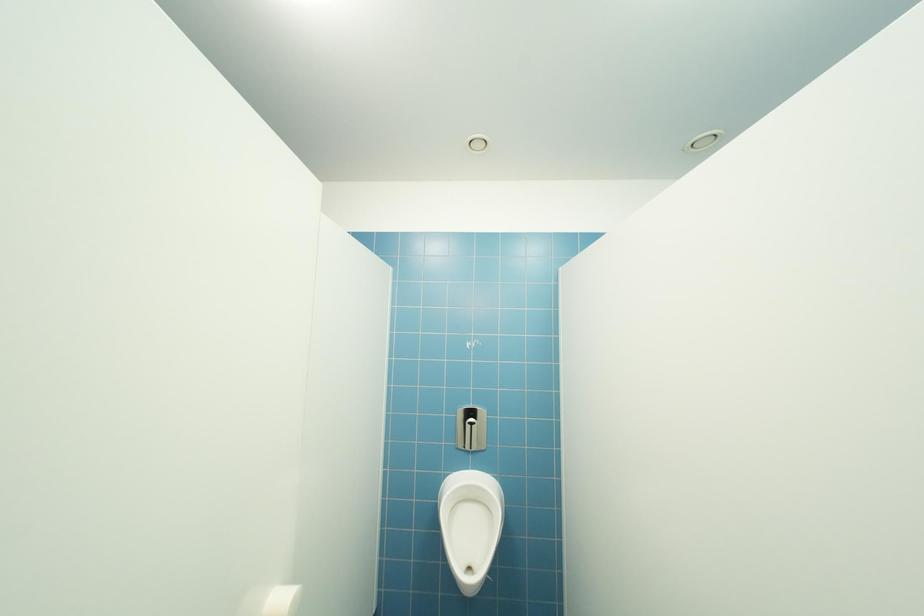
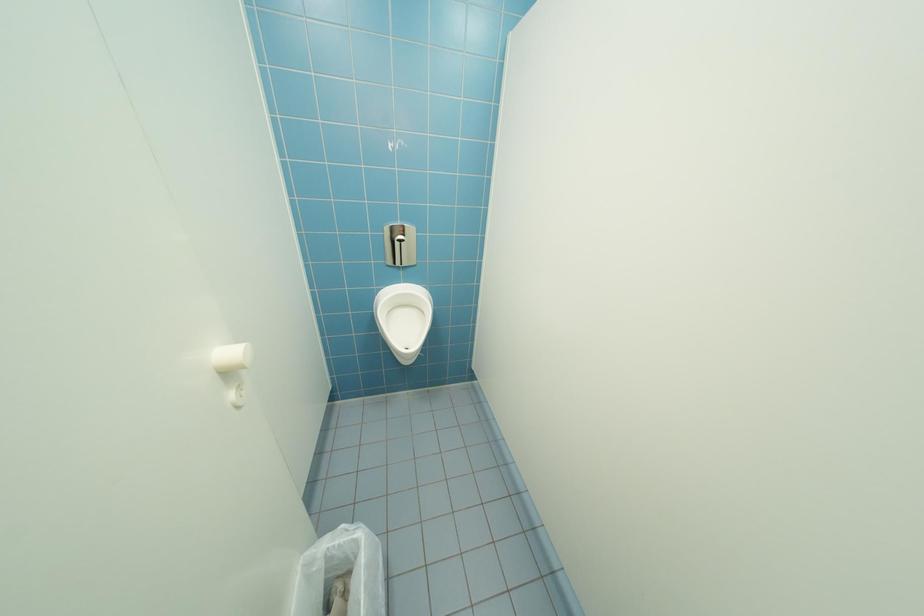
Based on the continuous images, in which direction is the camera rotating?

The rotation direction of the camera is right-down.